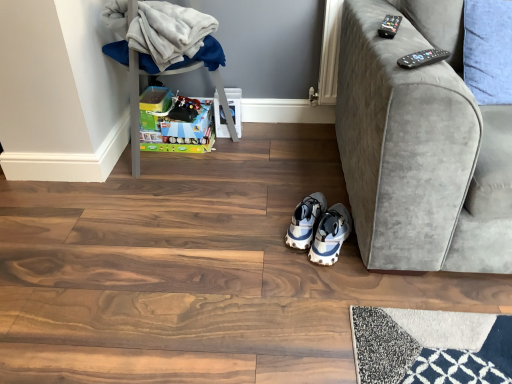
Question: From the image's perspective, is plastic storage box at left located above or below blue fabric pillow at upper right?

Choices:
 (A) above
 (B) below

Answer: (A)

Question: From a real-world perspective, relative to blue fabric pillow at upper right, is plastic storage box at left vertically above or below?

Choices:
 (A) below
 (B) above

Answer: (A)

Question: Which is nearer to the black plastic remote at upper right, the second remote when ordered from bottom to top?

Choices:
 (A) matte plastic toy box at lower left
 (B) velvet gray couch at upper right
 (C) blue and white textured sneakers at center, marked as the 2th footwear in a right-to-left arrangement
 (D) white fluffy blanket at upper left
 (E) blue fabric pillow at upper right

Answer: (B)

Question: Which is farther from the blue fabric pillow at upper right?

Choices:
 (A) plastic storage box at left
 (B) black plastic remote at upper right, which is counted as the second remote, starting from the back
 (C) white mesh sneakers at lower center, the 1th footwear when ordered from right to left
 (D) velvet gray couch at upper right
 (E) matte plastic toy box at lower left

Answer: (E)